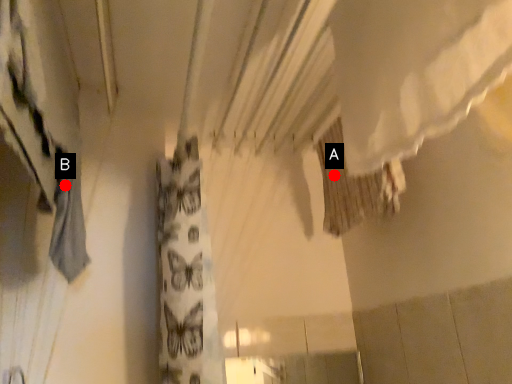
Question: Two points are circled on the image, labeled by A and B beside each circle. Which point is closer to the camera taking this photo?

Choices:
 (A) A is closer
 (B) B is closer

Answer: (B)